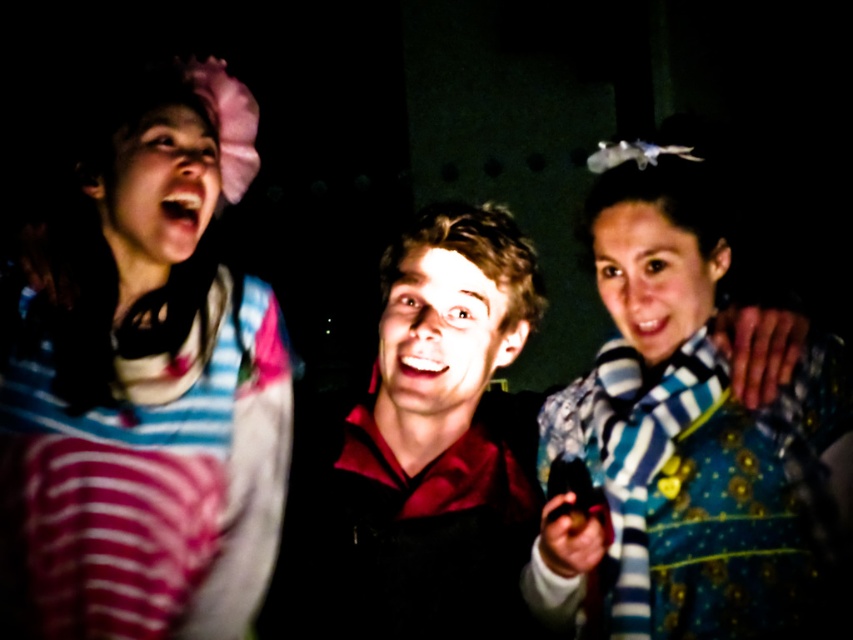
Question: Can you confirm if pink striped shirt at upper left is smaller than smooth blue scarf at center?

Choices:
 (A) yes
 (B) no

Answer: (B)

Question: Estimate the real-world distances between objects in this image. Which object is closer to the smooth blue scarf at center?

Choices:
 (A) smooth skin face at center
 (B) smooth skin face at upper left
 (C) blue striped scarf at center

Answer: (C)

Question: Is smooth skin face at upper left to the right of smooth blue scarf at center from the viewer's perspective?

Choices:
 (A) yes
 (B) no

Answer: (B)

Question: Which point is closer to the camera?

Choices:
 (A) pink striped shirt at upper left
 (B) matte red shirt at center
 (C) smooth skin face at upper left

Answer: (A)

Question: Which of the following is the closest to the observer?

Choices:
 (A) (395, 401)
 (B) (647, 336)

Answer: (B)

Question: Observing the image, what is the correct spatial positioning of matte red shirt at center in reference to smooth skin face at center?

Choices:
 (A) right
 (B) left

Answer: (B)